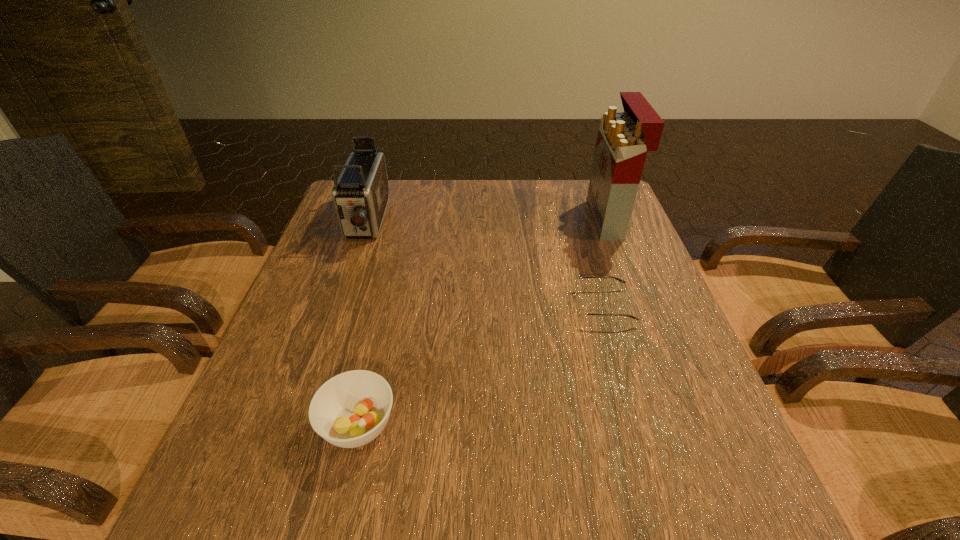
The width and height of the screenshot is (960, 540). In order to click on vacant region that satisfies the following two spatial constraints: 1. on the front-facing side of the shortest object; 2. on the front side of the soup bowl in this screenshot , I will do `click(638, 425)`.

The height and width of the screenshot is (540, 960). Identify the location of vacant point that satisfies the following two spatial constraints: 1. at the lens of the camcorder; 2. on the right side of the soup bowl. (296, 425).

The height and width of the screenshot is (540, 960). Identify the location of free point that satisfies the following two spatial constraints: 1. with the lid open on the tallest object; 2. at the lens of the camcorder. (609, 221).

The height and width of the screenshot is (540, 960). Identify the location of vacant point that satisfies the following two spatial constraints: 1. at the lens of the nearest object; 2. on the left side of the third shortest object. (296, 425).

Find the location of `vacant space that satisfies the following two spatial constraints: 1. at the lens of the camcorder; 2. on the right side of the nearest object`. vacant space that satisfies the following two spatial constraints: 1. at the lens of the camcorder; 2. on the right side of the nearest object is located at coordinates (296, 425).

The width and height of the screenshot is (960, 540). I want to click on free location that satisfies the following two spatial constraints: 1. with the lid open on the tallest object; 2. on the front side of the third tallest object, so click(688, 425).

Locate an element on the screen. The width and height of the screenshot is (960, 540). free space that satisfies the following two spatial constraints: 1. at the lens of the third shortest object; 2. on the left side of the soup bowl is located at coordinates (296, 425).